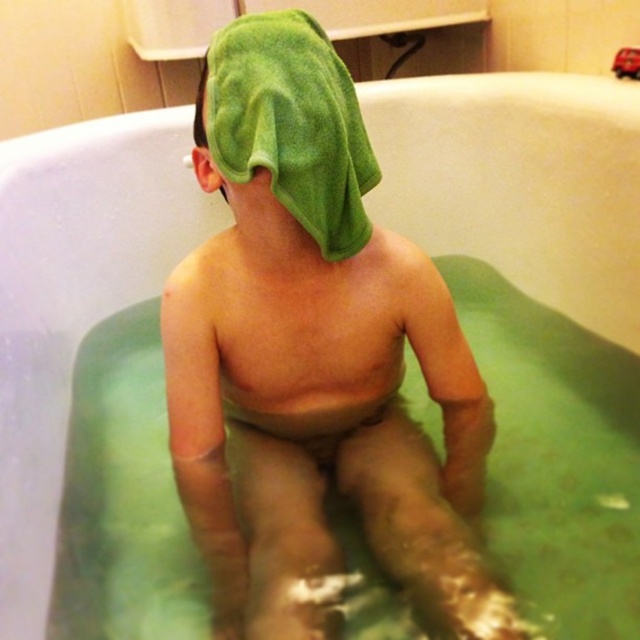
Question: Can you confirm if green towel at back is thinner than green soft towel at back?

Choices:
 (A) no
 (B) yes

Answer: (A)

Question: Which point is closer to the camera?

Choices:
 (A) (232, 160)
 (B) (212, 246)

Answer: (A)

Question: Which point is closer to the camera?

Choices:
 (A) green soft towel at back
 (B) green towel at back

Answer: (A)

Question: Is green towel at back smaller than green soft towel at back?

Choices:
 (A) no
 (B) yes

Answer: (A)

Question: Does green towel at back have a larger size compared to green soft towel at back?

Choices:
 (A) yes
 (B) no

Answer: (A)